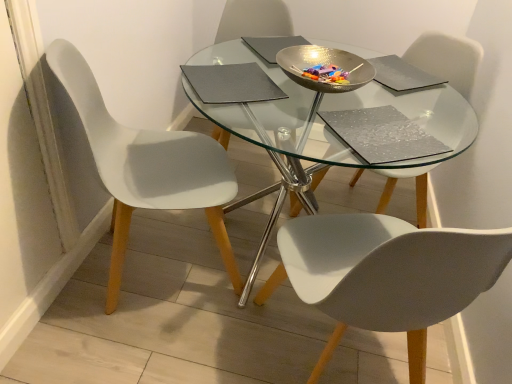
Find the location of a particular element. This screenshot has height=384, width=512. free spot below white matte chair at left, acting as the third chair starting from the right (from a real-world perspective) is located at coordinates (147, 263).